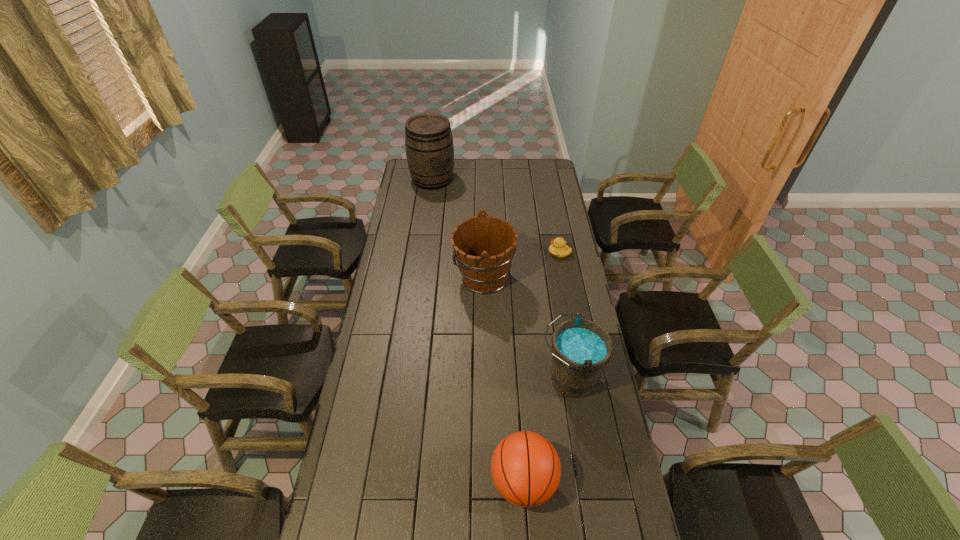
Identify the location of object that is at the left edge. (429, 146).

In order to click on wine bucket that is at the right edge in this screenshot , I will do `click(581, 349)`.

Find the location of a particular element. This screenshot has width=960, height=540. duckling at the right edge is located at coordinates (558, 248).

Locate an element on the screen. The height and width of the screenshot is (540, 960). object that is at the far left corner is located at coordinates (429, 146).

This screenshot has width=960, height=540. In order to click on free region at the far edge of the desktop in this screenshot , I will do `click(483, 159)`.

Where is `free region at the left edge`? free region at the left edge is located at coordinates (401, 246).

Identify the location of free point at the right edge. (545, 197).

Locate an element on the screen. vacant area at the far right corner is located at coordinates (552, 178).

Where is `free space between the shortest object and the second shortest object`? The width and height of the screenshot is (960, 540). free space between the shortest object and the second shortest object is located at coordinates (541, 367).

This screenshot has height=540, width=960. Find the location of `blank region between the second shortest object and the second farthest wine bucket`. blank region between the second shortest object and the second farthest wine bucket is located at coordinates (504, 380).